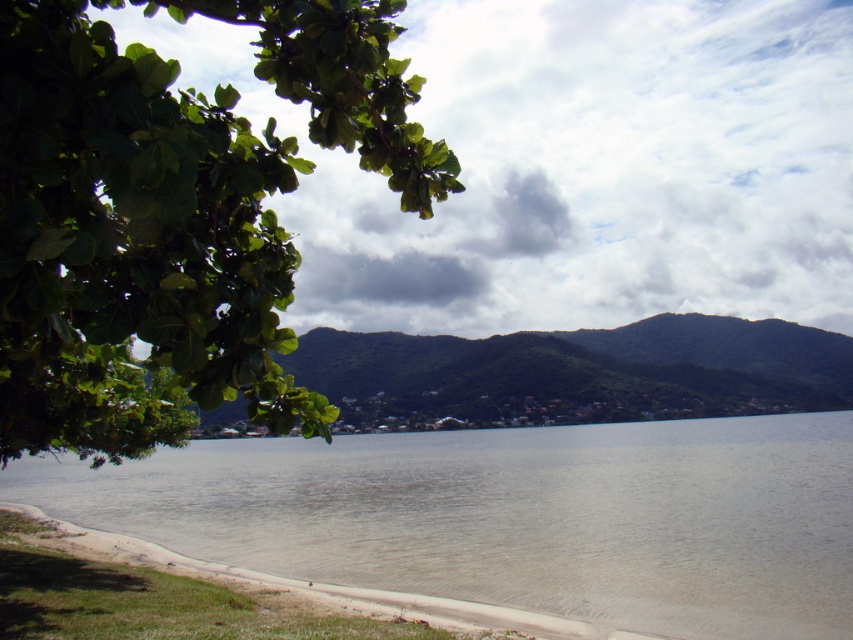
Question: Which of the following is the closest to the observer?

Choices:
 (A) (525, 346)
 (B) (467, 467)
 (C) (376, 140)

Answer: (C)

Question: Can you confirm if green leafy branch at upper left is positioned to the left of green leafy hill at center?

Choices:
 (A) no
 (B) yes

Answer: (B)

Question: Considering the relative positions of green leafy branch at upper left and green leafy hill at center in the image provided, where is green leafy branch at upper left located with respect to green leafy hill at center?

Choices:
 (A) left
 (B) right

Answer: (A)

Question: Among these points, which one is farthest from the camera?

Choices:
 (A) (157, 394)
 (B) (654, 502)
 (C) (445, 412)

Answer: (C)

Question: Considering the relative positions of green leafy branch at upper left and clear water at lower center in the image provided, where is green leafy branch at upper left located with respect to clear water at lower center?

Choices:
 (A) left
 (B) right

Answer: (A)

Question: Estimate the real-world distances between objects in this image. Which object is farther from the green leafy branch at upper left?

Choices:
 (A) clear water at lower center
 (B) green leafy hill at center

Answer: (B)